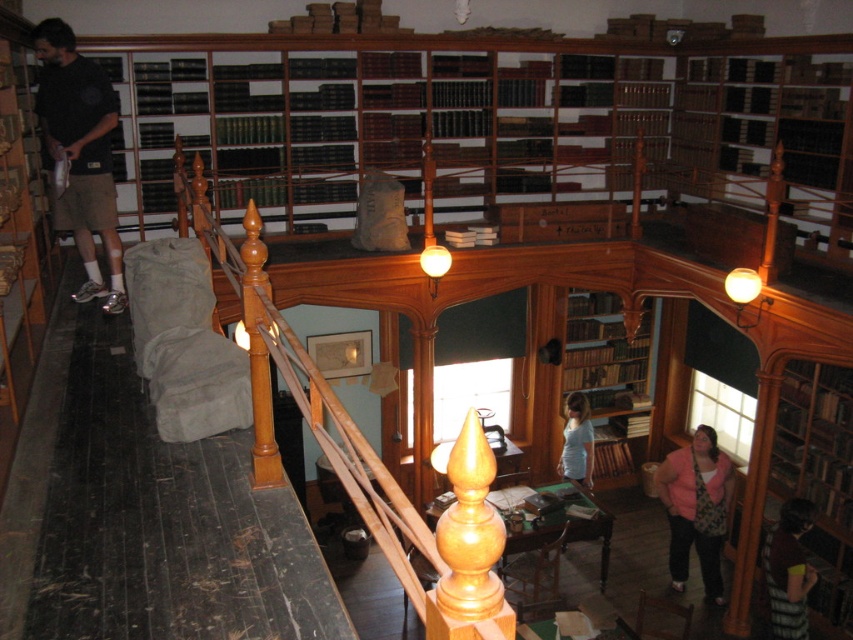
In the scene shown: You are standing at the entrance of the library and see the point marked at coordinates (80,154). What object is located at that point?

The object at point (80,154) is the matte black shirt at left.

Based on the provided scene description, what are the coordinates of the green matte bookcase at upper center in the image?

The coordinates of the green matte bookcase at upper center are at point (482, 120).

You are standing in the library and see the matte black shirt at left. If you want to take a closer look at it, how many steps should you take forward to reach it?

The matte black shirt at left is 14.57 feet away. Since an average step is about 2.5 feet, you would need to take approximately 6 steps forward to reach it.